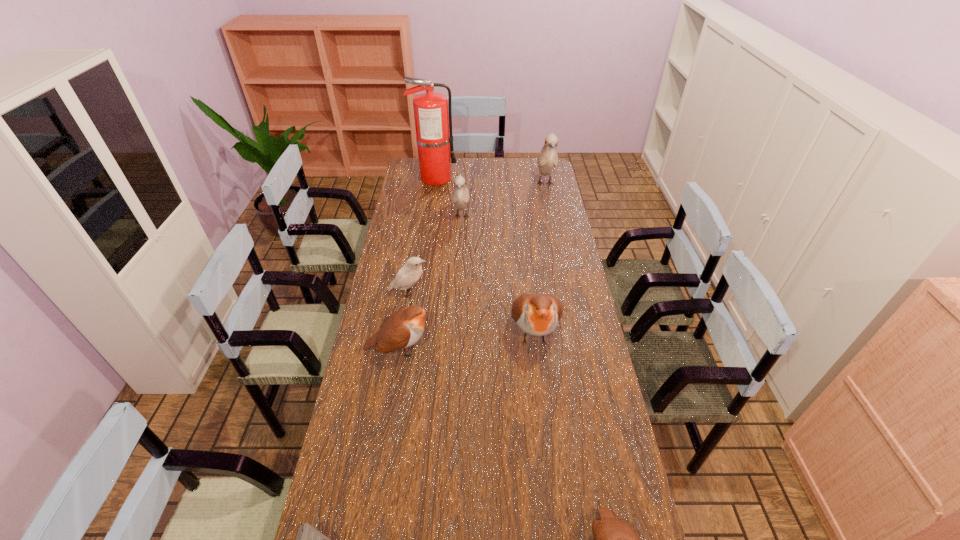
Find the location of a particular element. This screenshot has width=960, height=540. bird that is the fifth closest to the calculator is located at coordinates (460, 196).

Find the location of `the second closest white bird to the leftmost brown bird`. the second closest white bird to the leftmost brown bird is located at coordinates (460, 196).

Locate an element on the screen. The height and width of the screenshot is (540, 960). white bird that is the second closest to the second smallest brown bird is located at coordinates (460, 196).

Identify which brown bird is located as the second nearest to the second smallest brown bird. Please provide its 2D coordinates. Your answer should be formatted as a tuple, i.e. [(x, y)], where the tuple contains the x and y coordinates of a point satisfying the conditions above.

[(613, 539)]

Select which brown bird is the third closest to the fourth bird from right to left. Please provide its 2D coordinates. Your answer should be formatted as a tuple, i.e. [(x, y)], where the tuple contains the x and y coordinates of a point satisfying the conditions above.

[(613, 539)]

This screenshot has height=540, width=960. Find the location of `free spot that satisfies the following two spatial constraints: 1. at the beak of the fourth bird from right to left; 2. at the face of the second biggest brown bird`. free spot that satisfies the following two spatial constraints: 1. at the beak of the fourth bird from right to left; 2. at the face of the second biggest brown bird is located at coordinates (454, 349).